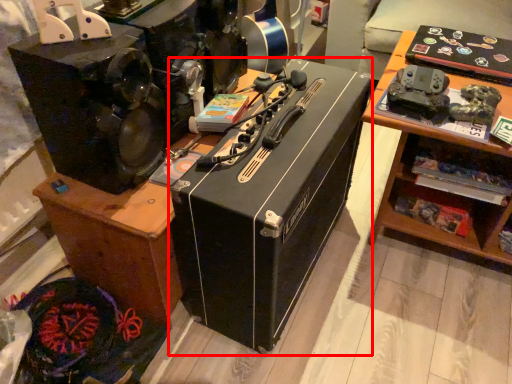
Question: From the image's perspective, what is the correct spatial positioning of box (annotated by the red box) in reference to furniture?

Choices:
 (A) above
 (B) below

Answer: (B)